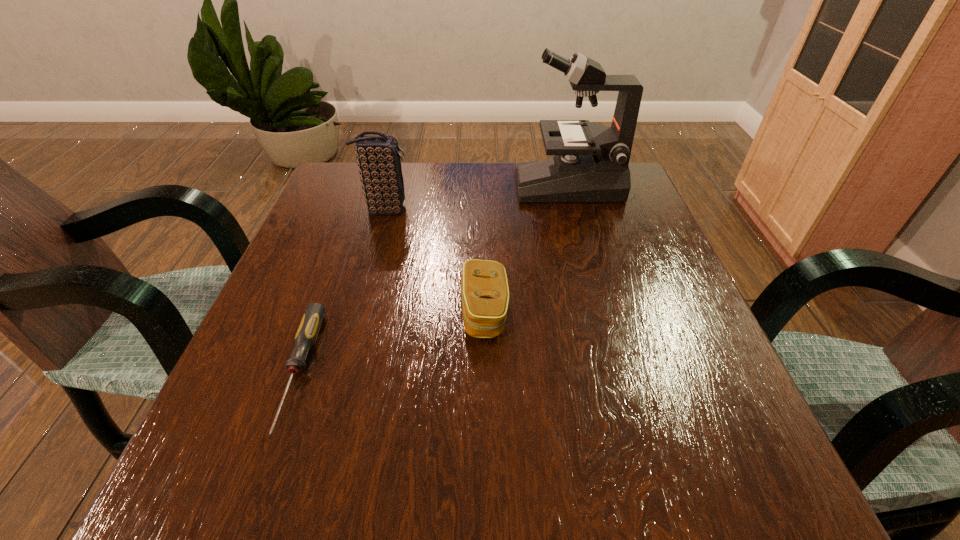
At what (x,y) coordinates should I click in order to perform the action: click on object at the far left corner. Please return your answer as a coordinate pair (x, y). Looking at the image, I should click on (379, 163).

Locate an element on the screen. The image size is (960, 540). object present at the near left corner is located at coordinates (308, 330).

The image size is (960, 540). I want to click on object situated at the far right corner, so click(x=590, y=164).

This screenshot has height=540, width=960. I want to click on free space at the far edge, so click(x=560, y=213).

Find the location of a particular element. vacant space at the near edge of the desktop is located at coordinates (625, 457).

You are a GUI agent. You are given a task and a screenshot of the screen. Output one action in this format:
    pyautogui.click(x=<x>, y=<y>)
    Task: Click on the free space at the left edge of the desktop
    The height and width of the screenshot is (540, 960).
    Given the screenshot: What is the action you would take?
    pyautogui.click(x=323, y=240)

In the image, there is a desktop. Where is `vacant space at the right edge`? The width and height of the screenshot is (960, 540). vacant space at the right edge is located at coordinates pyautogui.click(x=652, y=314).

The image size is (960, 540). Identify the location of free space at the far left corner of the desktop. (348, 179).

Find the location of a particular element. free space at the near left corner of the desktop is located at coordinates (185, 469).

The width and height of the screenshot is (960, 540). Find the location of `vacant space at the far right corner of the desktop`. vacant space at the far right corner of the desktop is located at coordinates (646, 213).